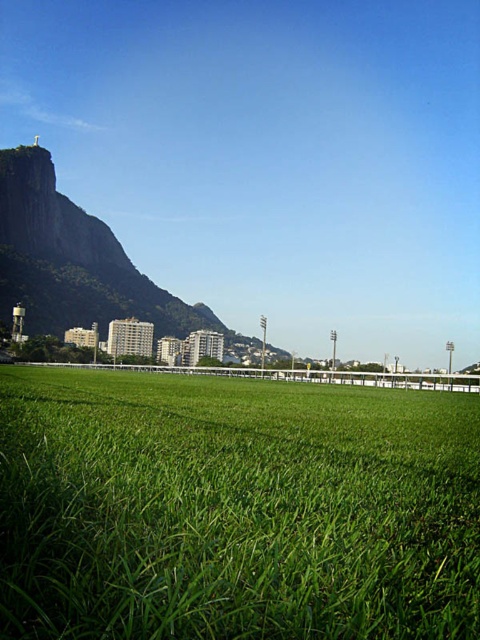
You are a landscape architect designing a new park. You have two areas to consider for a picnic spot. The green grass at center and the green grassy hill at left. Which area would you choose if you want a larger space for more people?

The green grassy hill at left is larger in size compared to the green grass at center, so it would be more suitable for a picnic spot accommodating more people.

You are standing on the sports field and looking towards the buildings in the background. Which part of the grass is nearer to you, the green grass at center or the green grassy hill at left?

The green grass at center is closer to the viewer than the green grassy hill at left, so the green grass at center is nearer to you.

You are a gardener who needs to mow the lawn. You see the green grass at center and the green grassy hill at left. Which area requires more frequent mowing due to faster growth?

The green grassy hill at left requires more frequent mowing because it is taller than the green grass at center, indicating faster growth.